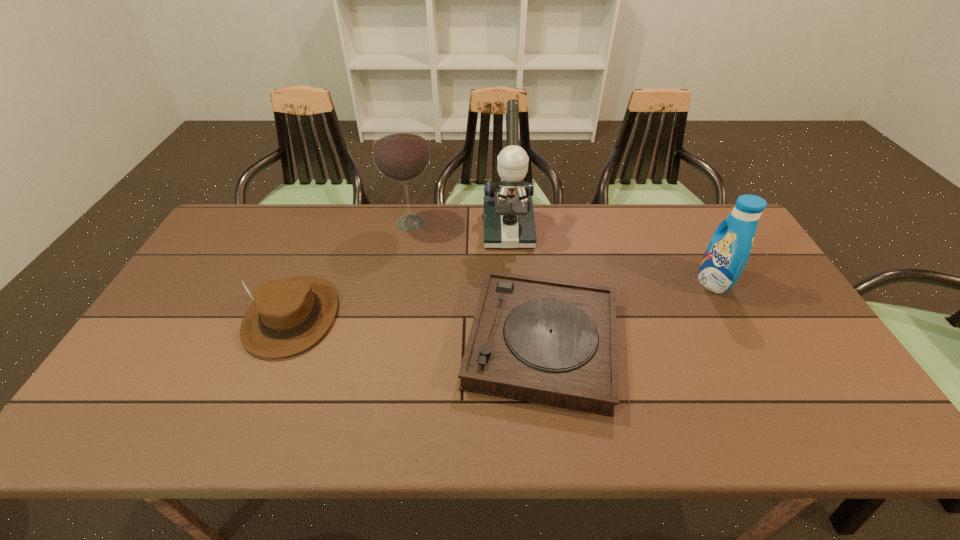
Where is `microscope`? This screenshot has height=540, width=960. microscope is located at coordinates tap(509, 223).

At what (x,y) coordinates should I click in order to perform the action: click on alcohol. Please return your answer as a coordinate pair (x, y). The image size is (960, 540). Looking at the image, I should click on (400, 150).

You are a GUI agent. You are given a task and a screenshot of the screen. Output one action in this format:
    pyautogui.click(x=<x>, y=<y>)
    Task: Click on the detergent
    This screenshot has height=540, width=960.
    Given the screenshot: What is the action you would take?
    tap(729, 248)

This screenshot has height=540, width=960. Find the location of `the rightmost object`. the rightmost object is located at coordinates (729, 248).

This screenshot has width=960, height=540. I want to click on fedora, so click(x=289, y=315).

This screenshot has width=960, height=540. I want to click on the leftmost object, so click(289, 315).

Locate an element on the screen. The image size is (960, 540). phonograph record is located at coordinates (544, 341).

Where is `free spot located 0.200m at the eyepiece of the microscope`? free spot located 0.200m at the eyepiece of the microscope is located at coordinates (513, 295).

Identify the location of vacant space located on the front of the second object from left to right. This screenshot has width=960, height=540. (393, 318).

This screenshot has height=540, width=960. Find the location of `vacant space located 0.090m on the front-facing side of the third tallest object`. vacant space located 0.090m on the front-facing side of the third tallest object is located at coordinates (669, 281).